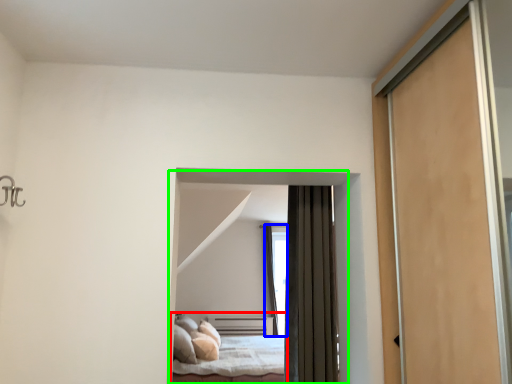
Question: Estimate the real-world distances between objects in this image. Which object is closer to bed (highlighted by a red box), window (highlighted by a blue box) or bed (highlighted by a green box)?

Choices:
 (A) window
 (B) bed

Answer: (A)